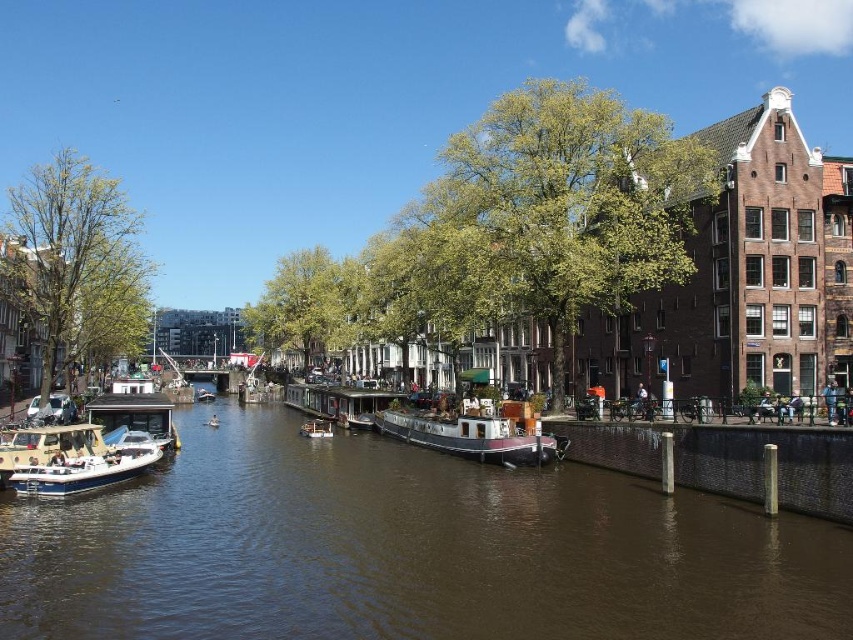
Does white glossy boat at lower left have a greater width compared to white glossy houseboat at center?

Yes, white glossy boat at lower left is wider than white glossy houseboat at center.

Is white glossy boat at lower left in front of white glossy houseboat at center?

Yes, it is in front of white glossy houseboat at center.

Is point (96, 481) positioned after point (325, 422)?

No, it is in front of (325, 422).

The height and width of the screenshot is (640, 853). I want to click on white glossy boat at lower left, so click(68, 460).

What do you see at coordinates (316, 428) in the screenshot? The image size is (853, 640). I see `white glossy houseboat at center` at bounding box center [316, 428].

Which of these two, white glossy houseboat at center or metallic silver boat at center, stands shorter?

Standing shorter between the two is white glossy houseboat at center.

Is point (306, 420) less distant than point (345, 422)?

No, it is behind (345, 422).

Where is `white glossy houseboat at center`? This screenshot has width=853, height=640. white glossy houseboat at center is located at coordinates (316, 428).

How distant is metallic silver boat at center from white glossy boat at center?

metallic silver boat at center and white glossy boat at center are 73.90 meters apart.

Can you confirm if metallic silver boat at center is positioned to the right of white glossy boat at center?

Correct, you'll find metallic silver boat at center to the right of white glossy boat at center.

Is point (372, 412) positioned behind point (196, 401)?

No.

This screenshot has height=640, width=853. In order to click on metallic silver boat at center in this screenshot , I will do `click(360, 420)`.